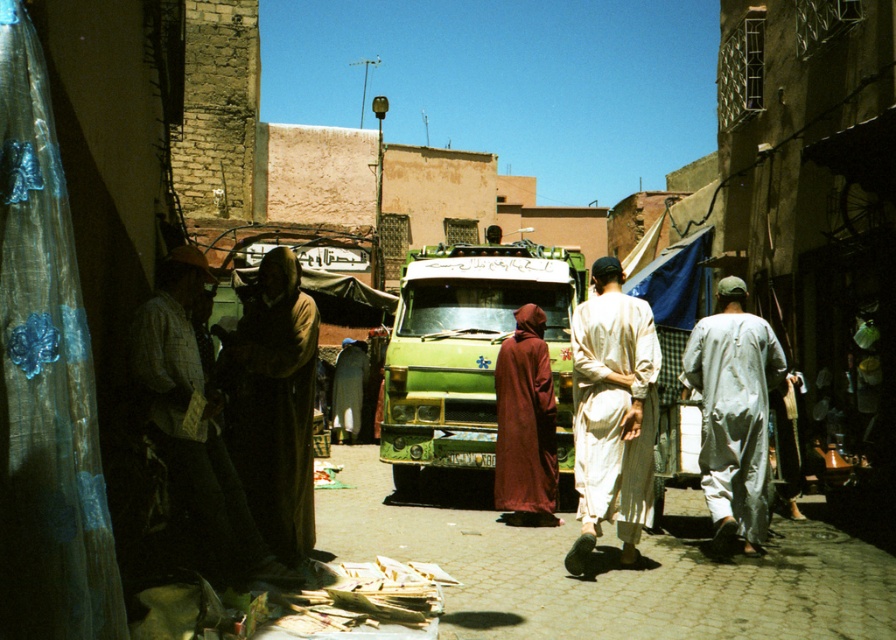
Question: Which of the following is the closest to the observer?

Choices:
 (A) white cotton robe at center
 (B) light brown fabric robe at center
 (C) light brown fabric robe at left
 (D) green matte ambulance at center

Answer: (C)

Question: Can you confirm if green matte ambulance at center is positioned to the left of white cotton robe at center?

Choices:
 (A) no
 (B) yes

Answer: (B)

Question: Which object appears farthest from the camera in this image?

Choices:
 (A) dark brown fabric at center
 (B) maroon velvet robe at center

Answer: (A)

Question: Is light brown fabric robe at left behind light brown fabric robe at center?

Choices:
 (A) yes
 (B) no

Answer: (B)

Question: Does light brown fabric robe at left appear over dark brown fabric at center?

Choices:
 (A) no
 (B) yes

Answer: (B)

Question: Among these objects, which one is nearest to the camera?

Choices:
 (A) maroon velvet robe at center
 (B) green matte ambulance at center

Answer: (A)